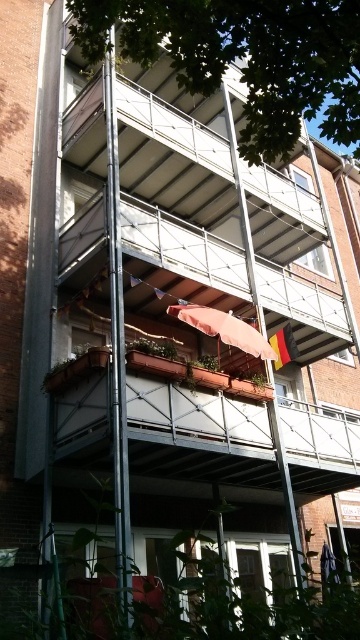
Based on the scene description, where is the green leafy tree at upper center located in terms of its 2D coordinates?

The green leafy tree at upper center is located at the 2D coordinates of point (x=245, y=58).

You are a window washer standing on the roof of the third balcony level. You need to clean the window of the green leafy tree at upper center and the matte pink fabric canopy at center. Which object will require you to climb higher to reach?

The green leafy tree at upper center requires climbing higher because it has a greater height compared to the matte pink fabric canopy at center.